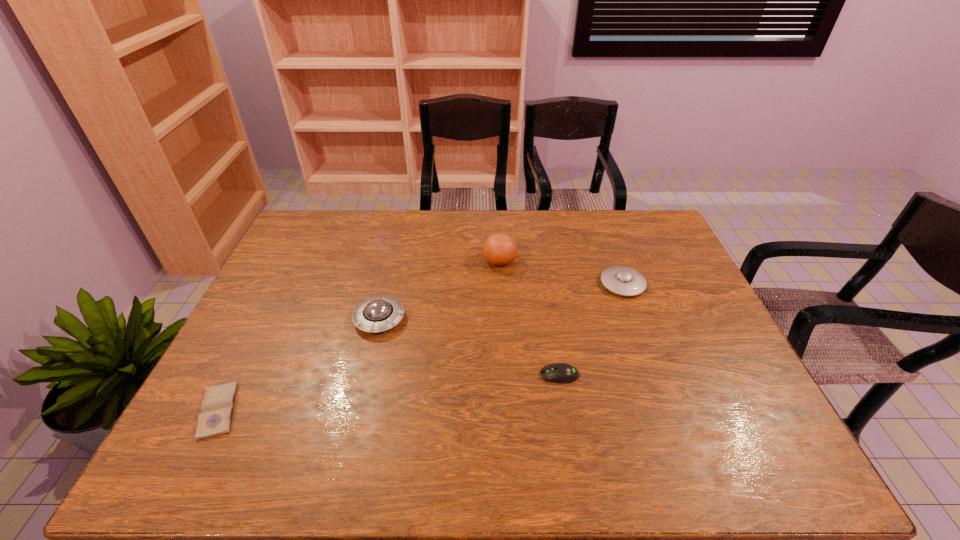
Locate an element on the screen. object located in the near left corner section of the desktop is located at coordinates (215, 418).

What are the coordinates of `vacant region at the far edge of the desktop` in the screenshot? It's located at (571, 220).

In the image, there is a desktop. Where is `vacant space at the near edge`? The image size is (960, 540). vacant space at the near edge is located at coordinates (590, 440).

The width and height of the screenshot is (960, 540). In order to click on free space at the left edge of the desktop in this screenshot , I will do `click(219, 368)`.

Where is `vacant position at the right edge of the desktop`? This screenshot has width=960, height=540. vacant position at the right edge of the desktop is located at coordinates (676, 285).

In the image, there is a desktop. Where is `vacant space at the far left corner`? The height and width of the screenshot is (540, 960). vacant space at the far left corner is located at coordinates (331, 247).

Identify the location of free spot between the third farthest object and the fourth tallest object. The width and height of the screenshot is (960, 540). (469, 347).

Identify the location of free space between the right saucer and the clementine. (561, 272).

The image size is (960, 540). Find the location of `blank region between the nearer saucer and the second shortest object`. blank region between the nearer saucer and the second shortest object is located at coordinates (469, 347).

Find the location of a particular element. This screenshot has width=960, height=540. vacant space that's between the second shortest object and the shortest object is located at coordinates (389, 393).